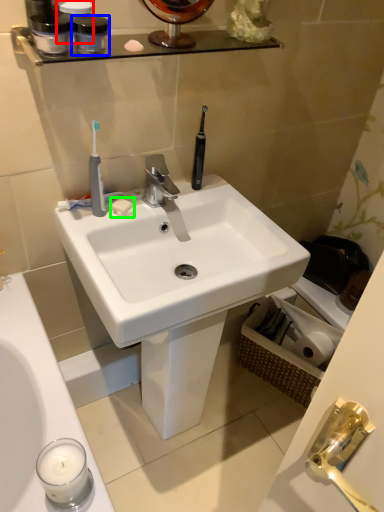
Question: Which is farther away from toiletry (highlighted by a red box)? mouthwash (highlighted by a blue box) or soap (highlighted by a green box)?

Choices:
 (A) mouthwash
 (B) soap

Answer: (B)